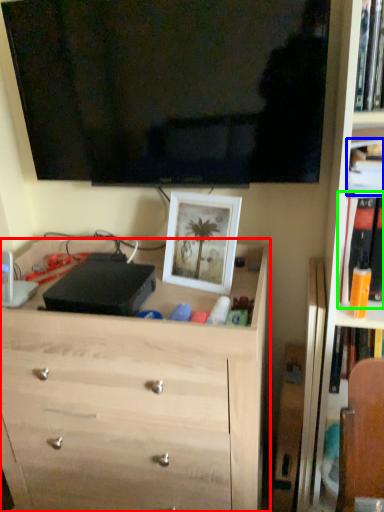
Question: Estimate the real-world distances between objects in this image. Which object is closer to chest of drawers (highlighted by a red box), book (highlighted by a blue box) or book (highlighted by a green box)?

Choices:
 (A) book
 (B) book

Answer: (B)